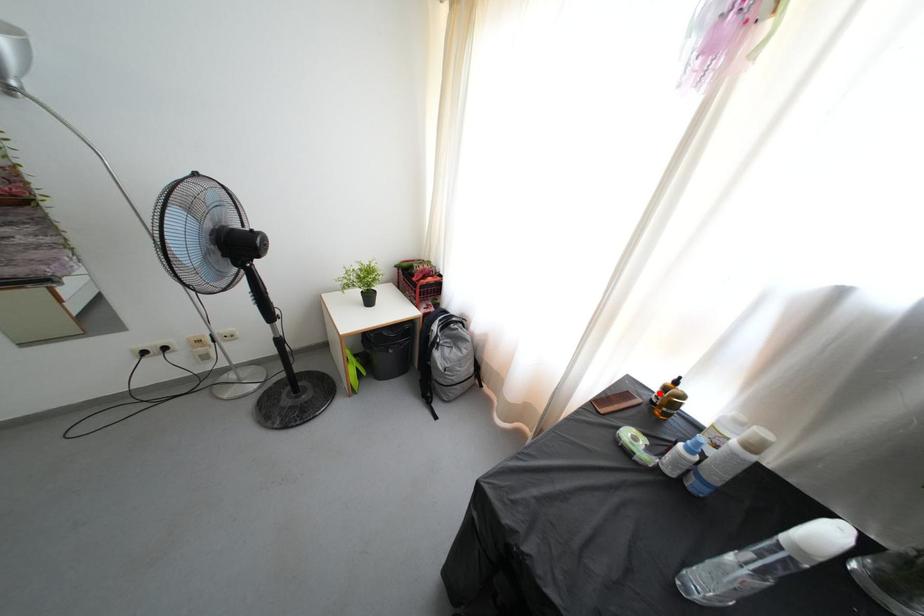
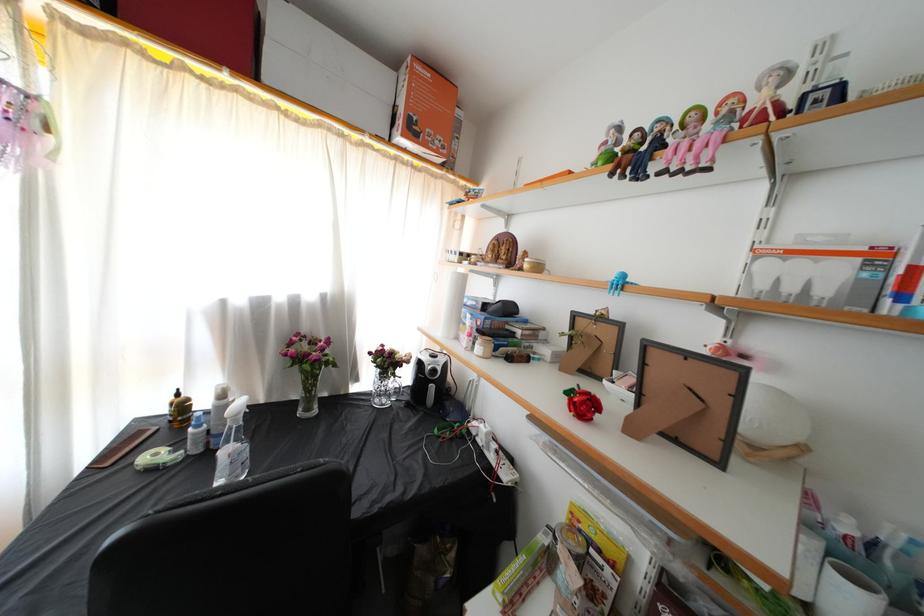
Find the pixel in the second image that matches the highlighted location in the first image.

(171, 416)